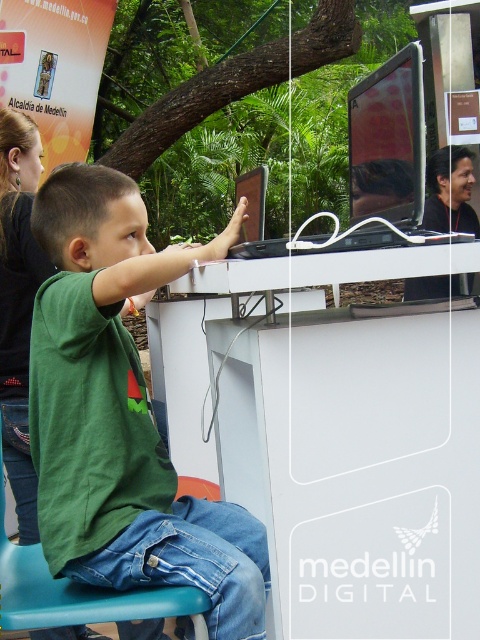
From the picture: You are a photographer standing at a distance of 1 meter from the subject. You want to take a closeup shot of the green matte shirt at center. Is the current distance sufficient?

The green matte shirt at center is 1.10 meters away from the camera, so the photographer needs to move 0.10 meters closer to achieve the desired closeup shot.

You are setting up a small office space. You have a matte black monitor at center and a blue plastic chair at lower left. Which object should you place closer to the desk to ensure comfortable use?

The matte black monitor at center should be placed closer to the desk since it is larger than the blue plastic chair at lower left, requiring more space for comfortable viewing and interaction.

You are a person sitting in the blue plastic chair at lower left. You want to reach the matte black monitor at center. Is the monitor within your immediate reach without moving your chair?

The matte black monitor at center is in front of the blue plastic chair at lower left, so it should be within immediate reach without needing to move the chair.